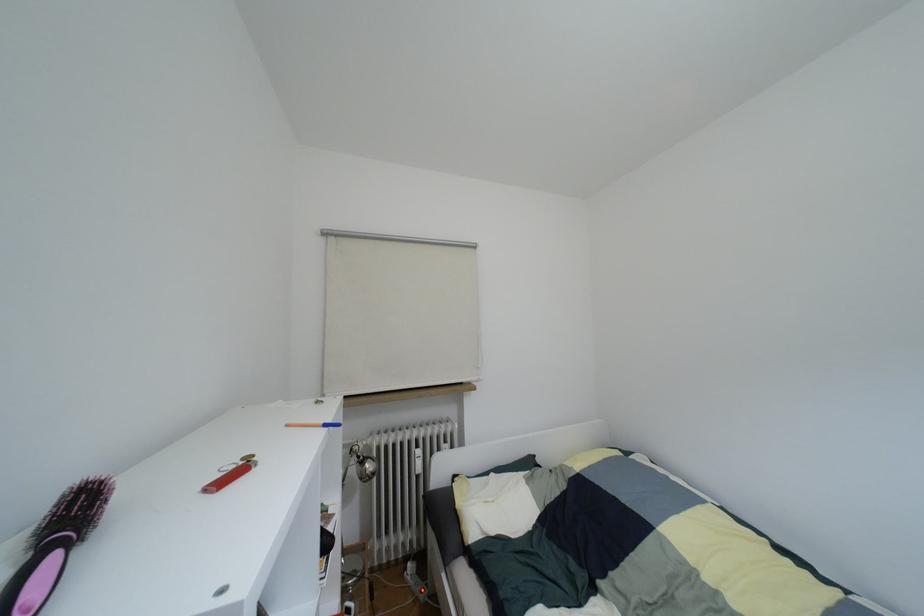
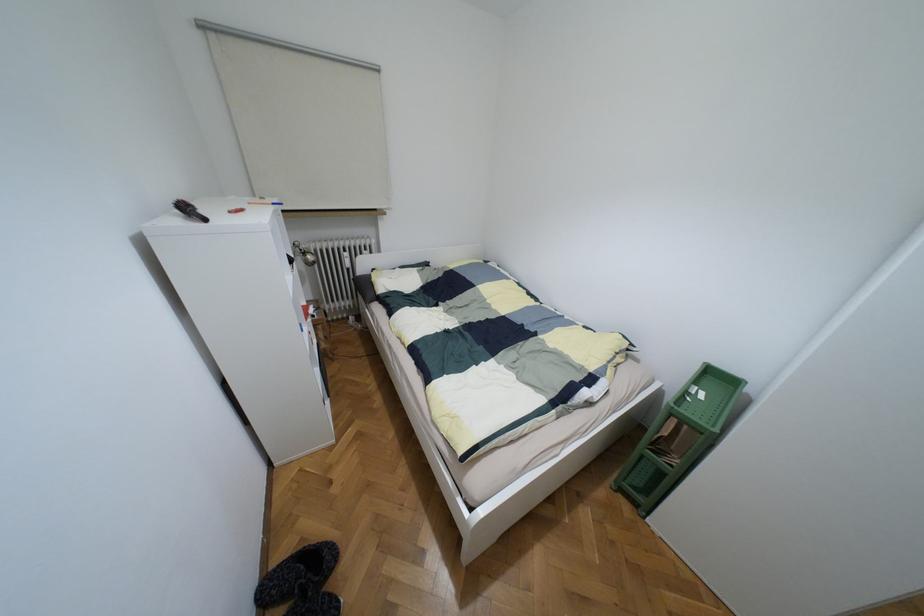
Question: Based on the continuous images, in which direction is the camera rotating? Reply with the corresponding letter.

Choices:
 (A) Left
 (B) Right
 (C) Up
 (D) Down

Answer: (D)